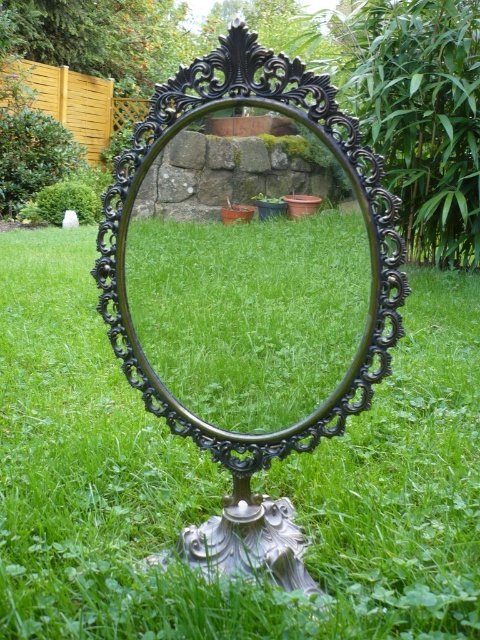
You are standing in front of the mirror on the grassy lawn. You notice two points marked in the image. The first point is at coordinate point(108, 381) and the second is at point(367, 275). Which point is closer to you?

Point(367, 275) is closer to you because it is in front of point(108, 381).

You are a gardener planning to place a new decorative item on the lawn. You have a 1.5 meter wide statue. Based on the scene, can the green grass at center accommodate the statue without overlapping the black ornate mirror at center?

The green grass at center might be wider than the black ornate mirror at center, so there is a possibility that the 1.5 meter wide statue can fit without overlapping the mirror. However, since the exact width isn not specified, it is recommended to measure the space before placing the statue.